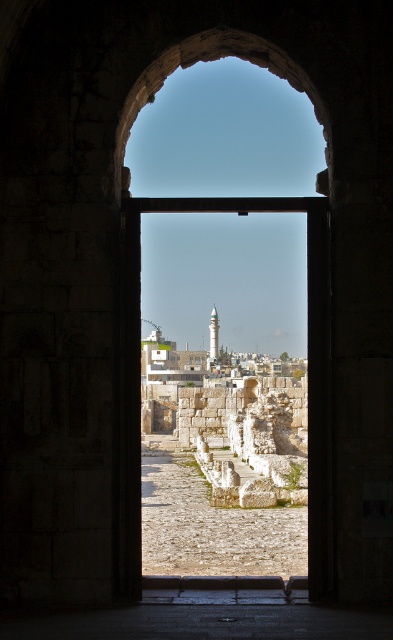
Question: Which point is farther from the camera taking this photo?

Choices:
 (A) (216, 321)
 (B) (326, 288)

Answer: (A)

Question: Does stone archway at center have a greater width compared to white marble minaret at center?

Choices:
 (A) yes
 (B) no

Answer: (A)

Question: Can you confirm if stone archway at center is wider than white marble minaret at center?

Choices:
 (A) yes
 (B) no

Answer: (A)

Question: From the image, what is the correct spatial relationship of stone archway at center in relation to white marble minaret at center?

Choices:
 (A) left
 (B) right

Answer: (B)

Question: Which point appears farthest from the camera in this image?

Choices:
 (A) (214, 316)
 (B) (123, 426)

Answer: (A)